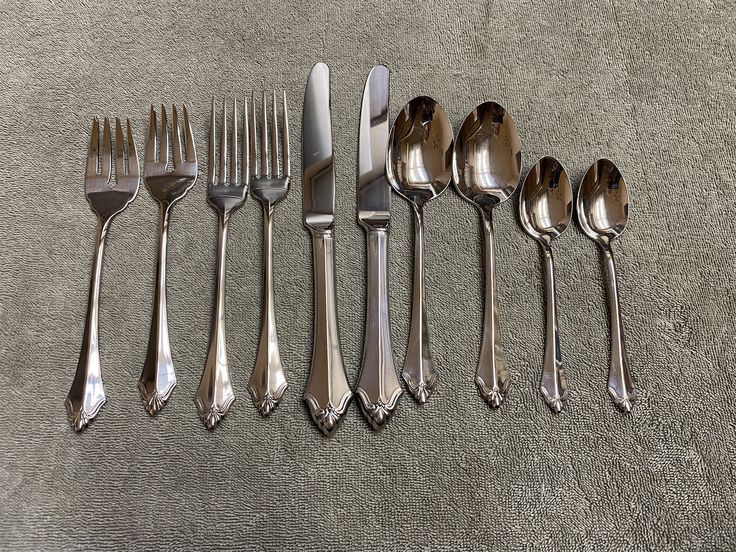
Identify the location of fork. This screenshot has height=552, width=736. (99, 250), (160, 259), (219, 283), (269, 284).